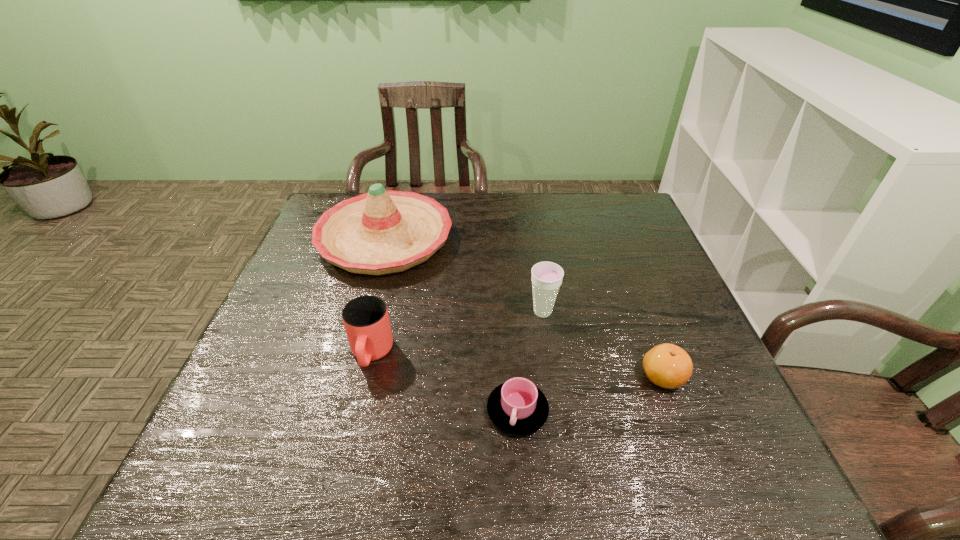
This screenshot has height=540, width=960. I want to click on the tallest object, so (x=380, y=232).

Where is `the farthest object`? the farthest object is located at coordinates (380, 232).

Where is `the second farthest object`? The image size is (960, 540). the second farthest object is located at coordinates (546, 277).

In order to click on the leftmost cup in this screenshot , I will do `click(366, 320)`.

Where is `the fourth tallest object`? The height and width of the screenshot is (540, 960). the fourth tallest object is located at coordinates [666, 365].

This screenshot has height=540, width=960. I want to click on clementine, so click(666, 365).

The image size is (960, 540). Identify the location of the shortest cup. (518, 407).

Locate an element on the screen. Image resolution: width=960 pixels, height=540 pixels. the shortest object is located at coordinates (518, 407).

In order to click on blank space located 0.390m on the front of the farthest object in this screenshot , I will do point(337,415).

Where is `free space located 0.130m on the right of the farthest cup`? free space located 0.130m on the right of the farthest cup is located at coordinates (611, 312).